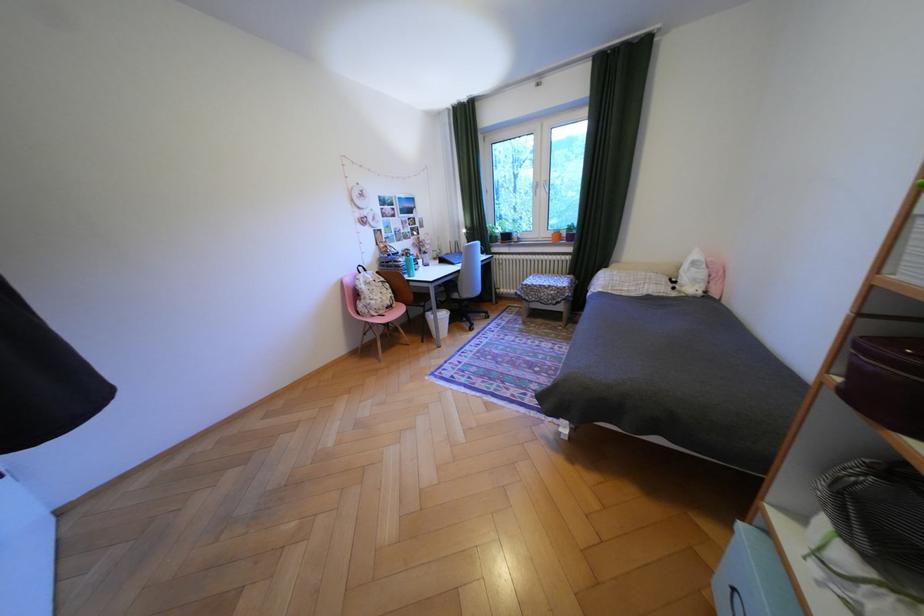
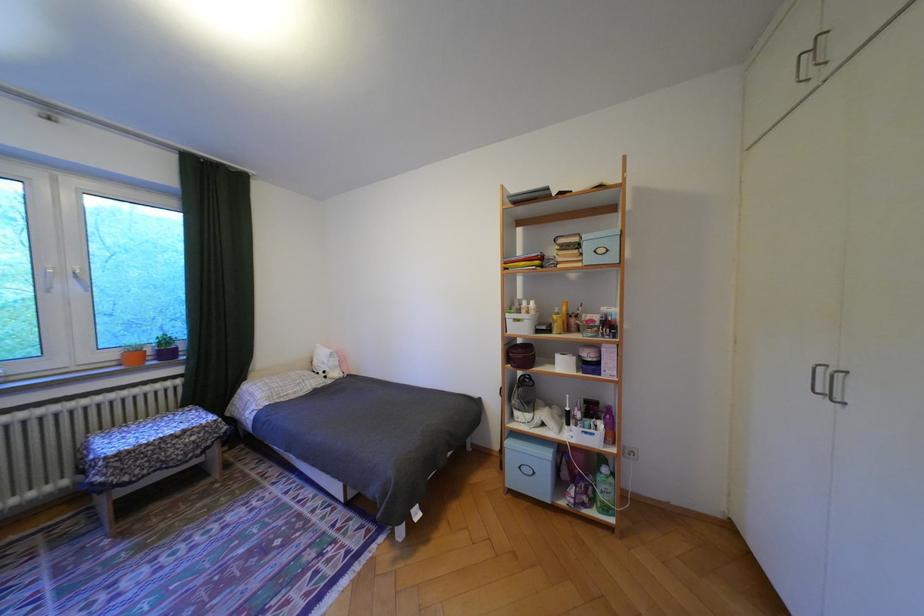
Question: I am providing you with two images of the same scene from different viewpoints. After the viewpoint changes to image2, which objects are now occluded?

Choices:
 (A) white plastic basket
 (B) yellow spray bottle
 (C) maroon round case
 (D) none of these

Answer: (D)